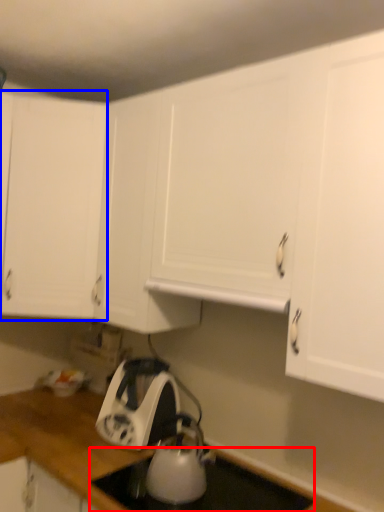
Question: Which object appears farthest to the camera in this image, gas stove (highlighted by a red box) or cabinetry (highlighted by a blue box)?

Choices:
 (A) gas stove
 (B) cabinetry

Answer: (B)